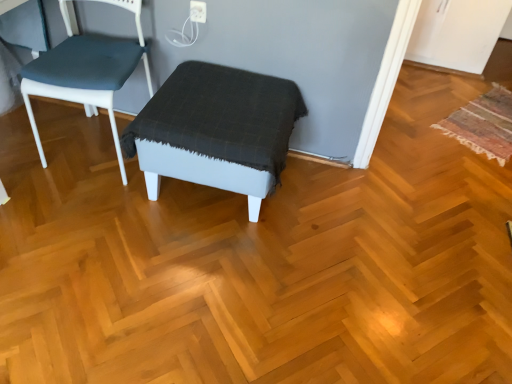
Image resolution: width=512 pixels, height=384 pixels. I want to click on vacant space in between matte blue fabric chair at left and matte gray stool at center, so click(101, 190).